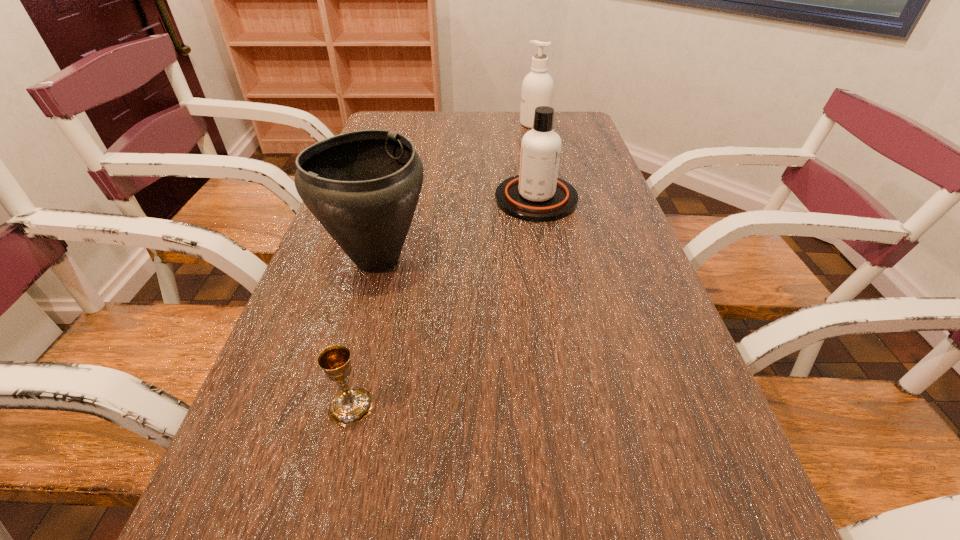
This screenshot has width=960, height=540. In order to click on the farther cleansing agent in this screenshot , I will do `click(537, 88)`.

Where is `urn`? urn is located at coordinates (363, 187).

Locate an element on the screen. The height and width of the screenshot is (540, 960). the second farthest object is located at coordinates (536, 194).

The height and width of the screenshot is (540, 960). Find the location of `the nearest object`. the nearest object is located at coordinates (350, 406).

Locate an element on the screen. the shortest object is located at coordinates (350, 406).

The width and height of the screenshot is (960, 540). Find the location of `free region located on the front label of the farther cleansing agent`. free region located on the front label of the farther cleansing agent is located at coordinates (503, 124).

At what (x,y) coordinates should I click in order to perform the action: click on free space located 0.160m on the front label of the farther cleansing agent. Please return your answer as a coordinate pair (x, y). The height and width of the screenshot is (540, 960). Looking at the image, I should click on [474, 124].

Find the location of `vacant space located on the front label of the farther cleansing agent`. vacant space located on the front label of the farther cleansing agent is located at coordinates (452, 124).

The height and width of the screenshot is (540, 960). I want to click on free region located 0.370m on the right of the urn, so click(592, 259).

Identify the location of free space located 0.230m on the front of the third nearest object. The width and height of the screenshot is (960, 540). (551, 284).